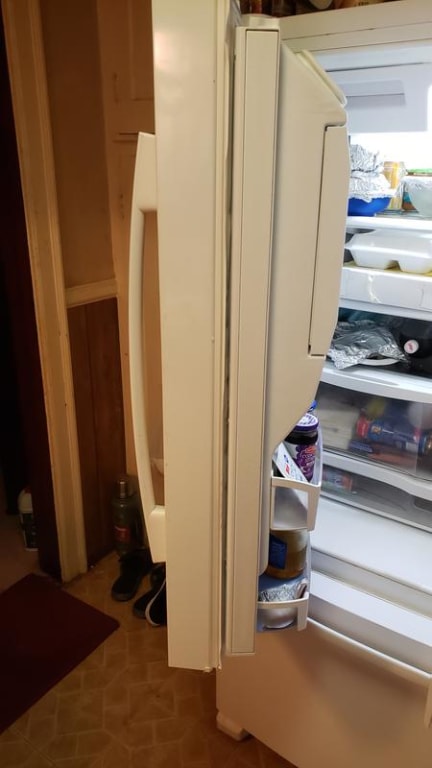
What are the coordinates of `jar in refrigerator door` in the screenshot? It's located at (289, 551).